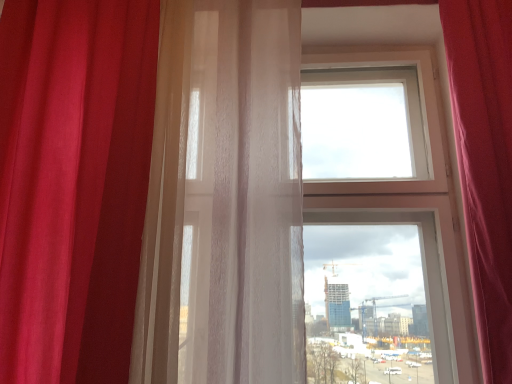
Question: Is velvet red curtain at right, which is counted as the first curtain, starting from the right, not within translucent white curtain at left, which ranks as the second curtain in right-to-left order?

Choices:
 (A) yes
 (B) no

Answer: (A)

Question: Does velvet red curtain at right, the third curtain in the left-to-right sequence, touch translucent white curtain at left, which ranks as the second curtain in right-to-left order?

Choices:
 (A) no
 (B) yes

Answer: (A)

Question: From the image's perspective, is velvet red curtain at right, the third curtain in the left-to-right sequence, over translucent white curtain at left, which ranks as the second curtain in left-to-right order?

Choices:
 (A) yes
 (B) no

Answer: (B)

Question: Is velvet red curtain at right, which is counted as the first curtain, starting from the right, positioned with its back to translucent white curtain at left, which ranks as the second curtain in right-to-left order?

Choices:
 (A) no
 (B) yes

Answer: (A)

Question: From a real-world perspective, does velvet red curtain at right, the third curtain in the left-to-right sequence, stand above translucent white curtain at left, which ranks as the second curtain in left-to-right order?

Choices:
 (A) no
 (B) yes

Answer: (A)

Question: Can you confirm if velvet red curtain at right, which is counted as the first curtain, starting from the right, is smaller than translucent white curtain at left, which ranks as the second curtain in right-to-left order?

Choices:
 (A) yes
 (B) no

Answer: (A)

Question: Is translucent white curtain at left, which ranks as the second curtain in left-to-right order, oriented towards satin red curtain at left, marked as the first curtain in a left-to-right arrangement?

Choices:
 (A) no
 (B) yes

Answer: (A)

Question: Can you confirm if translucent white curtain at left, which ranks as the second curtain in right-to-left order, is bigger than satin red curtain at left, marked as the first curtain in a left-to-right arrangement?

Choices:
 (A) no
 (B) yes

Answer: (A)

Question: Is the position of translucent white curtain at left, which ranks as the second curtain in left-to-right order, less distant than that of satin red curtain at left, which ranks as the 3th curtain in right-to-left order?

Choices:
 (A) no
 (B) yes

Answer: (A)

Question: Is translucent white curtain at left, which ranks as the second curtain in left-to-right order, looking in the opposite direction of satin red curtain at left, marked as the first curtain in a left-to-right arrangement?

Choices:
 (A) yes
 (B) no

Answer: (B)

Question: Can you confirm if translucent white curtain at left, which ranks as the second curtain in right-to-left order, is thinner than satin red curtain at left, which ranks as the 3th curtain in right-to-left order?

Choices:
 (A) yes
 (B) no

Answer: (A)

Question: Does translucent white curtain at left, which ranks as the second curtain in left-to-right order, have a smaller size compared to satin red curtain at left, marked as the first curtain in a left-to-right arrangement?

Choices:
 (A) no
 (B) yes

Answer: (B)

Question: Could you tell me if translucent white curtain at left, which ranks as the second curtain in right-to-left order, is turned towards velvet red curtain at right, the third curtain in the left-to-right sequence?

Choices:
 (A) yes
 (B) no

Answer: (B)